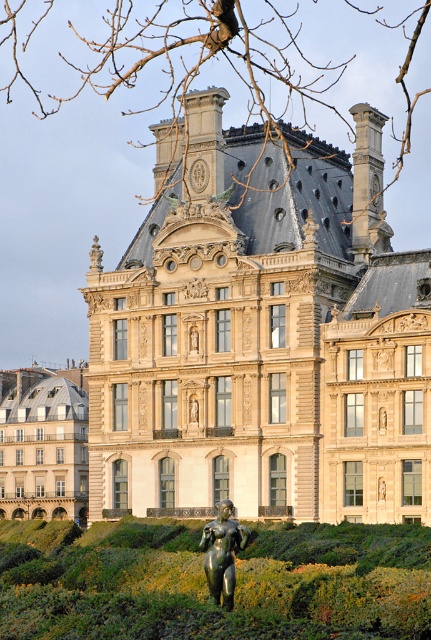
Which is in front, point (75, 472) or point (228, 598)?

Point (228, 598)

Between beige stone building at lower left and bronze statue at center, which one appears on the right side from the viewer's perspective?

bronze statue at center is more to the right.

Find the location of `beige stone building at lower left`. beige stone building at lower left is located at coordinates (43, 442).

The height and width of the screenshot is (640, 431). What are the coordinates of `beige stone building at lower left` in the screenshot? It's located at (43, 442).

Can you confirm if green grass at lower center is smaller than beige stone building at lower left?

No.

The width and height of the screenshot is (431, 640). Describe the element at coordinates (206, 582) in the screenshot. I see `green grass at lower center` at that location.

You are a GUI agent. You are given a task and a screenshot of the screen. Output one action in this format:
    pyautogui.click(x=<x>, y=<y>)
    Task: Click on the green grass at lower center
    This screenshot has height=640, width=431.
    Given the screenshot: What is the action you would take?
    pos(206,582)

Between beige stone palace at center and green grass at lower center, which one appears on the left side from the viewer's perspective?

Positioned to the left is green grass at lower center.

Describe the element at coordinates (261, 336) in the screenshot. This screenshot has width=431, height=640. I see `beige stone palace at center` at that location.

Is point (240, 156) positioned behind point (340, 538)?

Yes, point (240, 156) is farther from viewer.

At what (x,y) coordinates should I click in order to perform the action: click on beige stone palace at center. Please return your answer as a coordinate pair (x, y). Looking at the image, I should click on coord(261,336).